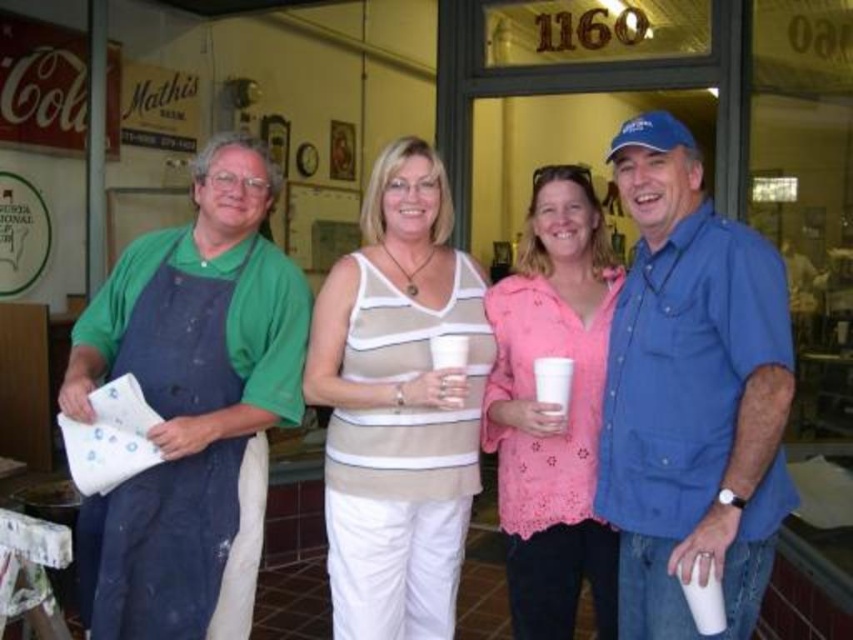
You are a photographer trying to capture a clear shot of both the blue cotton shirt at right and the beige striped tank top at center. Which of the two should you focus on first to ensure both are in focus?

The blue cotton shirt at right is closer to the viewer than the beige striped tank top at center, so focus on the blue cotton shirt at right first to ensure both are in focus.

You are a photographer trying to capture a group photo of the pink lace blouse at center and the blue denim apron at center. The camera you are using has a minimum focus distance of 10 inches. Can you take a clear photo of both subjects without moving them?

The pink lace blouse at center and blue denim apron at center are 10.21 inches apart, which is just over the camera minimum focus distance of 10 inches. Therefore, you can take a clear photo of both subjects without moving them.